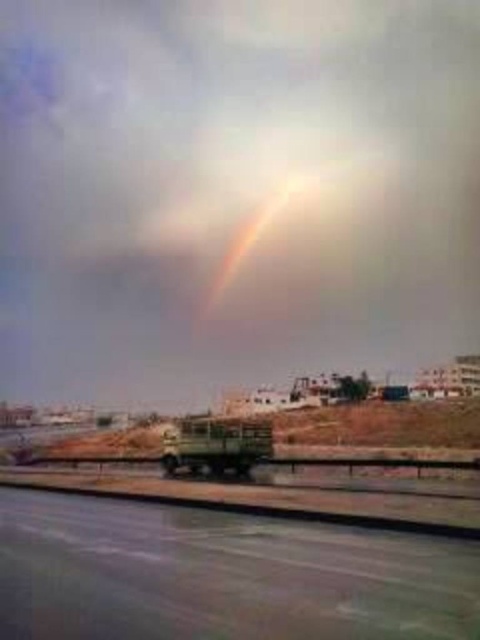
Is the position of green matte trailer truck at center more distant than that of rainbow at center?

That is False.

Is green matte trailer truck at center smaller than rainbow at center?

Yes, green matte trailer truck at center is smaller than rainbow at center.

In order to click on green matte trailer truck at center in this screenshot , I will do `click(216, 445)`.

Identify the location of green matte trailer truck at center. Image resolution: width=480 pixels, height=640 pixels. (216, 445).

Does smooth asphalt highway at lower center have a smaller size compared to rainbow at center?

Yes.

Is point (360, 593) farther from camera compared to point (303, 173)?

No, (360, 593) is in front of (303, 173).

Between point (80, 557) and point (215, 288), which one is positioned behind?

Positioned behind is point (215, 288).

Locate an element on the screen. The height and width of the screenshot is (640, 480). smooth asphalt highway at lower center is located at coordinates (222, 576).

Locate an element on the screen. The width and height of the screenshot is (480, 640). rainbow translucent cloud at upper center is located at coordinates (233, 192).

You are a GUI agent. You are given a task and a screenshot of the screen. Output one action in this format:
    pyautogui.click(x=<x>, y=<y>)
    Task: Click on the rainbow translucent cloud at upper center
    The width and height of the screenshot is (480, 640).
    Given the screenshot: What is the action you would take?
    pyautogui.click(x=233, y=192)